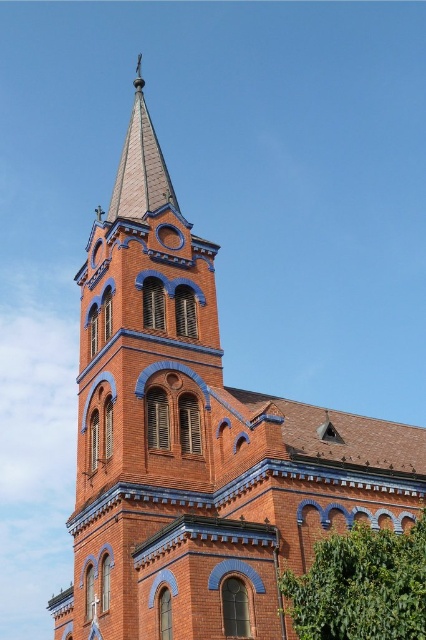
Question: Among these points, which one is farthest from the camera?

Choices:
 (A) (144, 113)
 (B) (319, 573)

Answer: (A)

Question: Among these objects, which one is nearest to the camera?

Choices:
 (A) green leafy tree at lower right
 (B) shiny blue tile spire at upper center

Answer: (A)

Question: Does green leafy tree at lower right appear over shiny blue tile spire at upper center?

Choices:
 (A) yes
 (B) no

Answer: (B)

Question: Which point appears farthest from the camera in this image?

Choices:
 (A) (146, 128)
 (B) (307, 628)

Answer: (A)

Question: Does green leafy tree at lower right have a smaller size compared to shiny blue tile spire at upper center?

Choices:
 (A) yes
 (B) no

Answer: (A)

Question: Observing the image, what is the correct spatial positioning of green leafy tree at lower right in reference to shiny blue tile spire at upper center?

Choices:
 (A) above
 (B) below

Answer: (B)